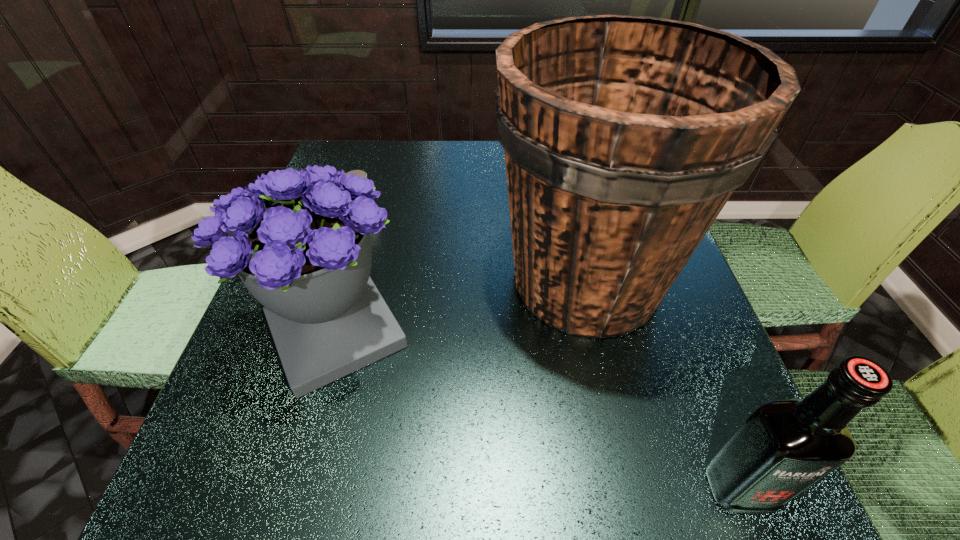
The width and height of the screenshot is (960, 540). Identify the location of bucket at the right edge. (624, 137).

This screenshot has width=960, height=540. Find the location of `liquor located in the right edge section of the desktop`. liquor located in the right edge section of the desktop is located at coordinates (784, 447).

Identify the location of object positioned at the near right corner. pos(784,447).

Where is `free space at the far edge of the desktop`? The width and height of the screenshot is (960, 540). free space at the far edge of the desktop is located at coordinates (410, 163).

You are a GUI agent. You are given a task and a screenshot of the screen. Output one action in this format:
    pyautogui.click(x=<x>, y=<y>)
    Task: Click on the free point between the jam and the bucket
    The width and height of the screenshot is (960, 540).
    Given the screenshot: What is the action you would take?
    pyautogui.click(x=475, y=247)

You are a GUI agent. You are given a task and a screenshot of the screen. Output one action in this format:
    pyautogui.click(x=<x>, y=<y>)
    Task: Click on the unoccupied area between the nearest object and the bucket
    
    Given the screenshot: What is the action you would take?
    pyautogui.click(x=663, y=384)

Where is `free spot between the bouquet and the bucket`? This screenshot has width=960, height=540. free spot between the bouquet and the bucket is located at coordinates (461, 306).

You are a GUI agent. You are given a task and a screenshot of the screen. Output one action in this format:
    pyautogui.click(x=<x>, y=<y>)
    Task: Click on the vacant space that is in between the bouquet and the nearest object
    Image resolution: width=960 pixels, height=540 pixels.
    Given the screenshot: What is the action you would take?
    pyautogui.click(x=539, y=410)

This screenshot has width=960, height=540. I want to click on vacant region between the tallest object and the bouquet, so click(461, 306).

The width and height of the screenshot is (960, 540). What are the coordinates of `free space between the nearest object and the bouquet` in the screenshot? It's located at (539, 410).